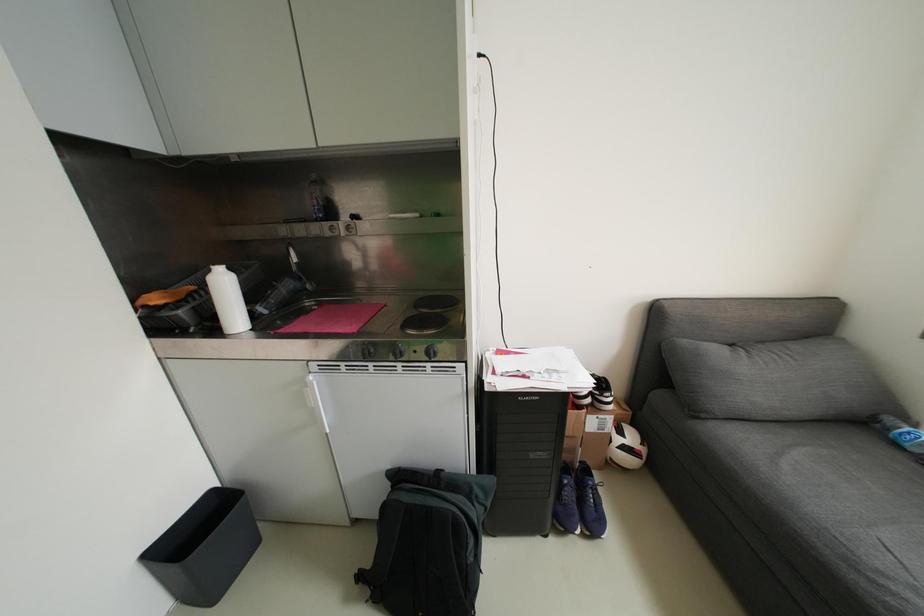
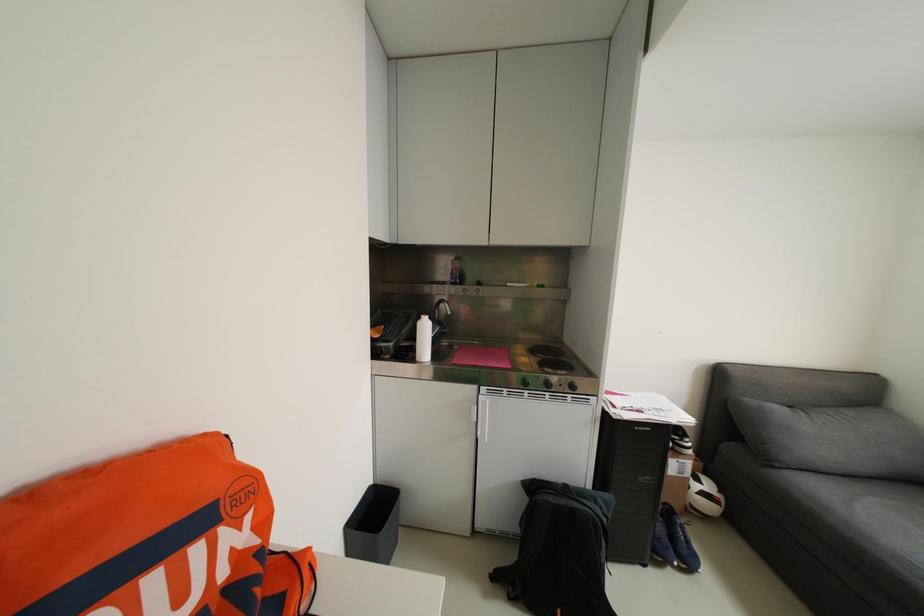
In a continuous first-person perspective shot, in which direction is the camera moving?

The cameraman moved toward left, backward.